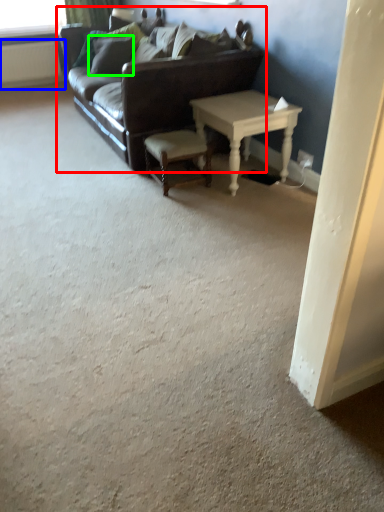
Question: Which is nearer to the studio couch (highlighted by a red box)? radiator (highlighted by a blue box) or pillow (highlighted by a green box).

Choices:
 (A) radiator
 (B) pillow

Answer: (B)